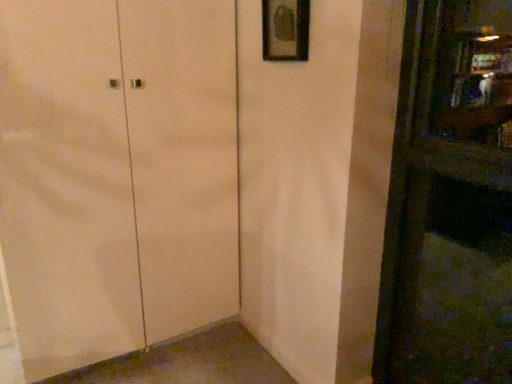
Question: Is the depth of matte black picture frame at upper center greater than that of matte white cabinet at center?

Choices:
 (A) no
 (B) yes

Answer: (B)

Question: Is matte black picture frame at upper center not inside matte white cabinet at center?

Choices:
 (A) yes
 (B) no

Answer: (A)

Question: Is the position of matte black picture frame at upper center less distant than that of matte white cabinet at center?

Choices:
 (A) yes
 (B) no

Answer: (B)

Question: From a real-world perspective, is matte black picture frame at upper center over matte white cabinet at center?

Choices:
 (A) yes
 (B) no

Answer: (A)

Question: From a real-world perspective, is matte black picture frame at upper center positioned under matte white cabinet at center based on gravity?

Choices:
 (A) no
 (B) yes

Answer: (A)

Question: Does matte black picture frame at upper center contain matte white cabinet at center?

Choices:
 (A) no
 (B) yes

Answer: (A)

Question: From a real-world perspective, is matte white cabinet at center on top of matte black picture frame at upper center?

Choices:
 (A) yes
 (B) no

Answer: (B)

Question: Does matte white cabinet at center appear on the right side of matte black picture frame at upper center?

Choices:
 (A) yes
 (B) no

Answer: (B)

Question: Is matte white cabinet at center oriented away from matte black picture frame at upper center?

Choices:
 (A) no
 (B) yes

Answer: (A)

Question: Is matte white cabinet at center wider than matte black picture frame at upper center?

Choices:
 (A) no
 (B) yes

Answer: (B)

Question: Is matte white cabinet at center closer to the viewer compared to matte black picture frame at upper center?

Choices:
 (A) yes
 (B) no

Answer: (A)

Question: From the image's perspective, is matte white cabinet at center beneath matte black picture frame at upper center?

Choices:
 (A) no
 (B) yes

Answer: (B)

Question: Is point (215, 165) positioned closer to the camera than point (267, 34)?

Choices:
 (A) farther
 (B) closer

Answer: (A)